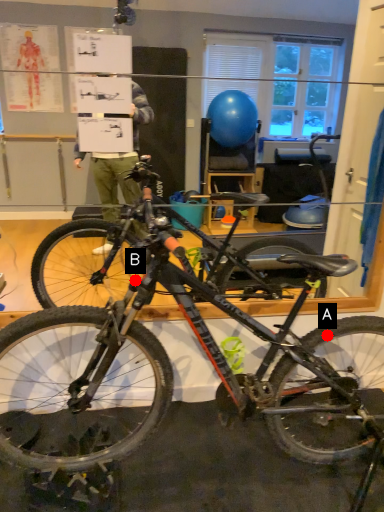
Question: Two points are circled on the image, labeled by A and B beside each circle. Among these points, which one is nearest to the camera?

Choices:
 (A) A is closer
 (B) B is closer

Answer: (B)